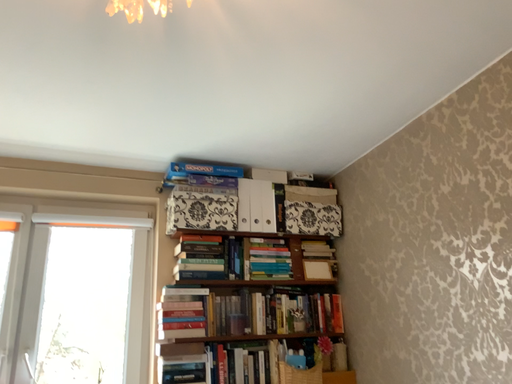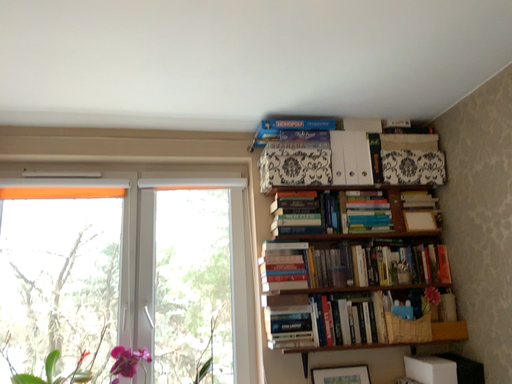
Question: Which way did the camera rotate in the video?

Choices:
 (A) rotated left
 (B) rotated right

Answer: (A)